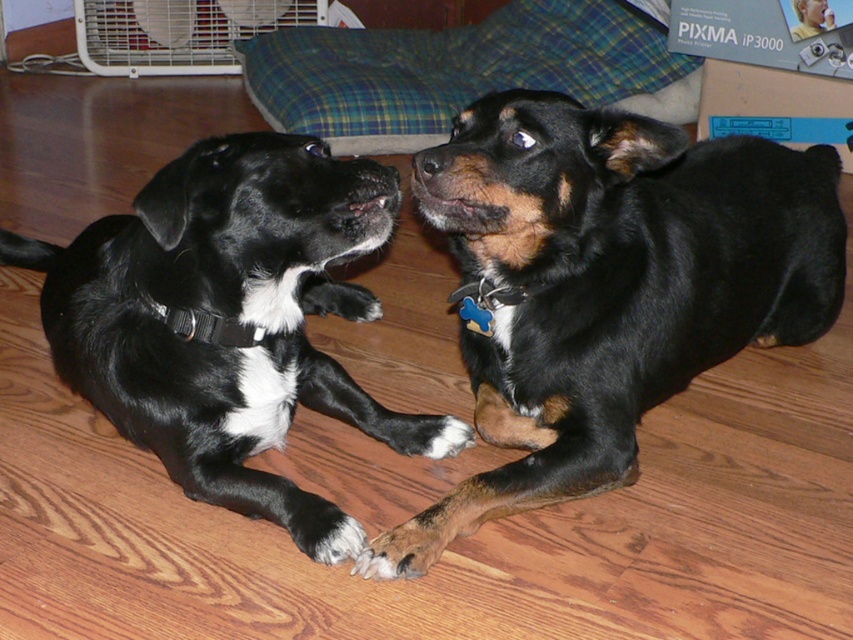
Question: Estimate the real-world distances between objects in this image. Which object is farther from the black shiny dog at center?

Choices:
 (A) black matte dog at center
 (B) smooth plastic toy at upper right

Answer: (B)

Question: Is black shiny dog at center positioned in front of brown furry paw at lower center?

Choices:
 (A) yes
 (B) no

Answer: (A)

Question: From the image, what is the correct spatial relationship of black shiny dog at center in relation to black matte dog at center?

Choices:
 (A) above
 (B) below

Answer: (A)

Question: Among these objects, which one is nearest to the camera?

Choices:
 (A) brown furry paw at lower center
 (B) black shiny dog at center

Answer: (B)

Question: Where is black shiny dog at center located in relation to brown furry paw at lower center in the image?

Choices:
 (A) below
 (B) above

Answer: (B)

Question: Which point is closer to the camera?

Choices:
 (A) brown furry paw at lower center
 (B) black shiny dog at center
 (C) smooth plastic toy at upper right

Answer: (B)